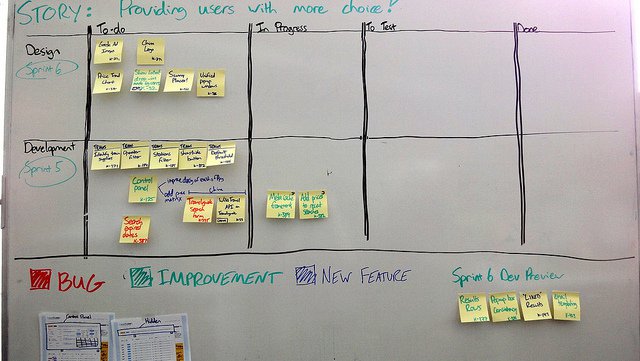
You are a GUI agent. You are given a task and a screenshot of the screen. Output one action in this format:
    pyautogui.click(x=<x>, y=<y>)
    Task: Click on the sheet of paper
    The height and width of the screenshot is (361, 640).
    Given the screenshot: What is the action you would take?
    pyautogui.click(x=70, y=339), pyautogui.click(x=159, y=332)